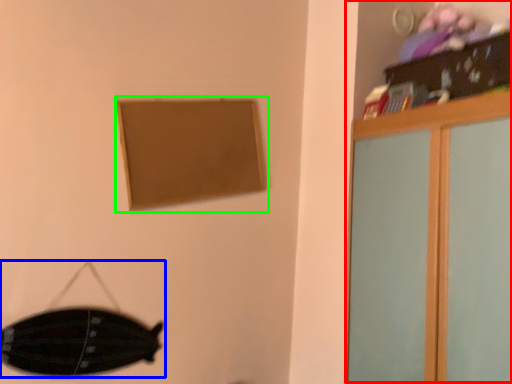
Question: Which object is positioned closest to dresser (highlighted by a red box)? Select from swivel chair (highlighted by a blue box) and picture frame (highlighted by a green box).

Choices:
 (A) swivel chair
 (B) picture frame

Answer: (B)